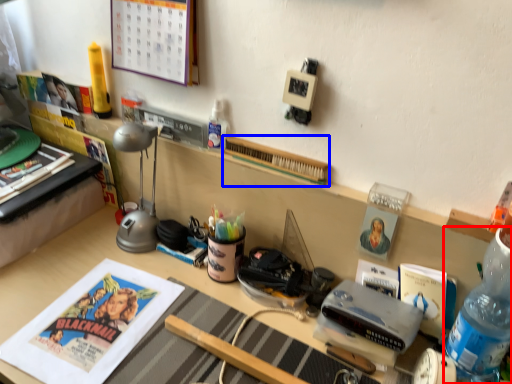
Question: Which object is closer to the camera taking this photo, bottle (highlighted by a red box) or book (highlighted by a blue box)?

Choices:
 (A) bottle
 (B) book

Answer: (A)